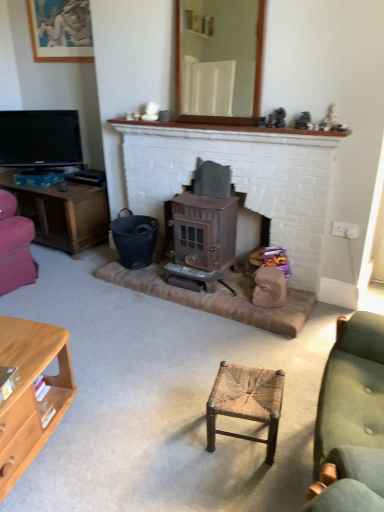
Question: Is woven wood stool at center shorter than green fabric couch at right?

Choices:
 (A) no
 (B) yes

Answer: (B)

Question: Is woven wood stool at center facing towards green fabric couch at right?

Choices:
 (A) yes
 (B) no

Answer: (B)

Question: Does woven wood stool at center touch green fabric couch at right?

Choices:
 (A) yes
 (B) no

Answer: (B)

Question: Is green fabric couch at right located within woven wood stool at center?

Choices:
 (A) yes
 (B) no

Answer: (B)

Question: Is woven wood stool at center turned away from green fabric couch at right?

Choices:
 (A) yes
 (B) no

Answer: (A)

Question: Based on their sizes in the image, would you say woven wood stool at center is bigger or smaller than bronze textured wood burning stove at center?

Choices:
 (A) small
 (B) big

Answer: (A)

Question: In the image, is woven wood stool at center positioned in front of or behind bronze textured wood burning stove at center?

Choices:
 (A) front
 (B) behind

Answer: (A)

Question: Is woven wood stool at center wider or thinner than bronze textured wood burning stove at center?

Choices:
 (A) thin
 (B) wide

Answer: (A)

Question: From their relative heights in the image, would you say woven wood stool at center is taller or shorter than bronze textured wood burning stove at center?

Choices:
 (A) tall
 (B) short

Answer: (B)

Question: Is clear glass mirror at upper center bigger or smaller than woven wood stool at center?

Choices:
 (A) small
 (B) big

Answer: (B)

Question: Is point (208, 48) positioned closer to the camera than point (269, 372)?

Choices:
 (A) closer
 (B) farther

Answer: (B)

Question: In the image, is clear glass mirror at upper center positioned in front of or behind woven wood stool at center?

Choices:
 (A) front
 (B) behind

Answer: (B)

Question: Considering the positions of clear glass mirror at upper center and woven wood stool at center in the image, is clear glass mirror at upper center taller or shorter than woven wood stool at center?

Choices:
 (A) tall
 (B) short

Answer: (A)

Question: In the image, is bronze textured wood burning stove at center positioned in front of or behind woven wood stool at center?

Choices:
 (A) behind
 (B) front

Answer: (A)

Question: Is bronze textured wood burning stove at center wider or thinner than woven wood stool at center?

Choices:
 (A) thin
 (B) wide

Answer: (B)